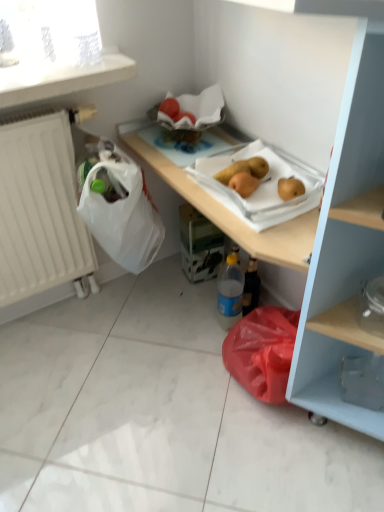
Question: Is yellow matte pear at center further to the viewer compared to white matte radiator at left?

Choices:
 (A) no
 (B) yes

Answer: (B)

Question: From a real-world perspective, is yellow matte pear at center positioned over white matte radiator at left based on gravity?

Choices:
 (A) no
 (B) yes

Answer: (B)

Question: From the image's perspective, is yellow matte pear at center on top of white matte radiator at left?

Choices:
 (A) yes
 (B) no

Answer: (A)

Question: Considering the relative positions of yellow matte pear at center and white matte radiator at left in the image provided, is yellow matte pear at center to the right of white matte radiator at left from the viewer's perspective?

Choices:
 (A) no
 (B) yes

Answer: (B)

Question: Considering the relative sizes of yellow matte pear at center and white matte radiator at left in the image provided, is yellow matte pear at center bigger than white matte radiator at left?

Choices:
 (A) yes
 (B) no

Answer: (B)

Question: Considering their positions, is blue plastic bottle at lower center located in front of or behind white matte radiator at left?

Choices:
 (A) behind
 (B) front

Answer: (A)

Question: Do you think blue plastic bottle at lower center is within white matte radiator at left, or outside of it?

Choices:
 (A) outside
 (B) inside

Answer: (A)

Question: Based on their positions, is blue plastic bottle at lower center located to the left or right of white matte radiator at left?

Choices:
 (A) left
 (B) right

Answer: (B)

Question: Is blue plastic bottle at lower center bigger or smaller than white matte radiator at left?

Choices:
 (A) small
 (B) big

Answer: (A)

Question: Is yellow matte pear at center inside or outside of blue plastic bottle at lower center?

Choices:
 (A) outside
 (B) inside

Answer: (A)

Question: Considering the positions of yellow matte pear at center and blue plastic bottle at lower center in the image, is yellow matte pear at center wider or thinner than blue plastic bottle at lower center?

Choices:
 (A) thin
 (B) wide

Answer: (B)

Question: Considering the positions of point pyautogui.click(x=263, y=167) and point pyautogui.click(x=230, y=273), is point pyautogui.click(x=263, y=167) closer or farther from the camera than point pyautogui.click(x=230, y=273)?

Choices:
 (A) closer
 (B) farther

Answer: (A)

Question: From the image's perspective, is yellow matte pear at center positioned above or below blue plastic bottle at lower center?

Choices:
 (A) above
 (B) below

Answer: (A)

Question: Based on their sizes in the image, would you say white matte radiator at left is bigger or smaller than blue plastic bottle at lower center?

Choices:
 (A) big
 (B) small

Answer: (A)

Question: From a real-world perspective, is white matte radiator at left positioned above or below blue plastic bottle at lower center?

Choices:
 (A) above
 (B) below

Answer: (A)